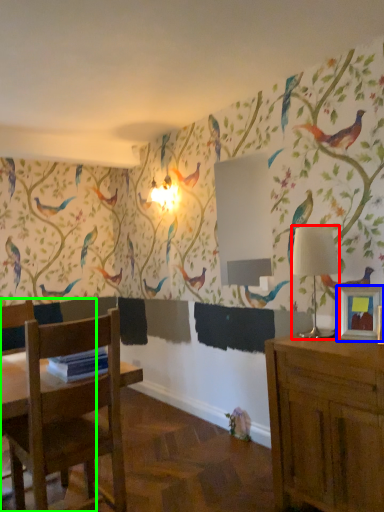
Question: Which object is positioned farthest from lamp (highlighted by a red box)? Select from picture frame (highlighted by a blue box) and chair (highlighted by a green box).

Choices:
 (A) picture frame
 (B) chair

Answer: (B)